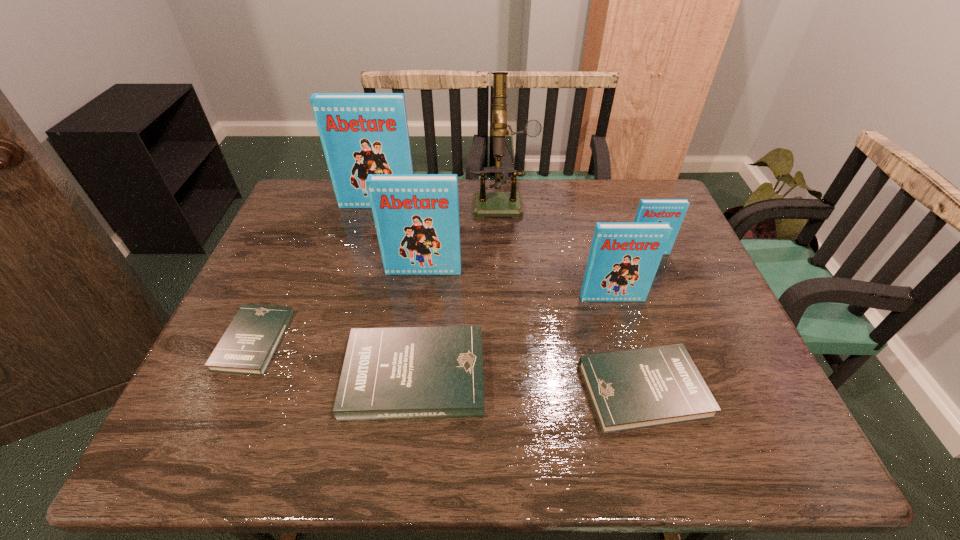
You are a GUI agent. You are given a task and a screenshot of the screen. Output one action in this format:
    pyautogui.click(x=<x>, y=<y>)
    Task: Click on the vacant area situated 0.140m on the left of the second dark book from left to right
    The height and width of the screenshot is (540, 960).
    Given the screenshot: What is the action you would take?
    pyautogui.click(x=282, y=375)

Locate an element on the screen. The width and height of the screenshot is (960, 540). free region located on the front of the second shortest book is located at coordinates (663, 459).

At what (x,y) coordinates should I click in order to perform the action: click on free region located on the back of the leftmost object. Please return your answer as a coordinate pair (x, y). The width and height of the screenshot is (960, 540). Looking at the image, I should click on (276, 290).

Image resolution: width=960 pixels, height=540 pixels. I want to click on microscope situated at the far edge, so (485, 204).

Image resolution: width=960 pixels, height=540 pixels. Identify the location of book positioned at the far edge. (361, 133).

Find the location of `object present at the far left corner`. object present at the far left corner is located at coordinates (361, 133).

Locate an element on the screen. This screenshot has width=960, height=540. object that is at the near right corner is located at coordinates (632, 389).

The width and height of the screenshot is (960, 540). Identify the location of free space at the far edge of the desktop. tap(621, 219).

The image size is (960, 540). Identify the location of vacant space at the left edge of the desktop. (326, 228).

In the image, there is a desktop. Where is `vacant space at the right edge`? The width and height of the screenshot is (960, 540). vacant space at the right edge is located at coordinates (700, 332).